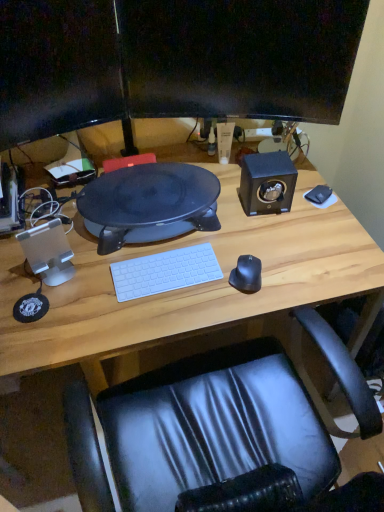
Identify the location of free point above wooden desk at center (from a real-world perspective). click(194, 241).